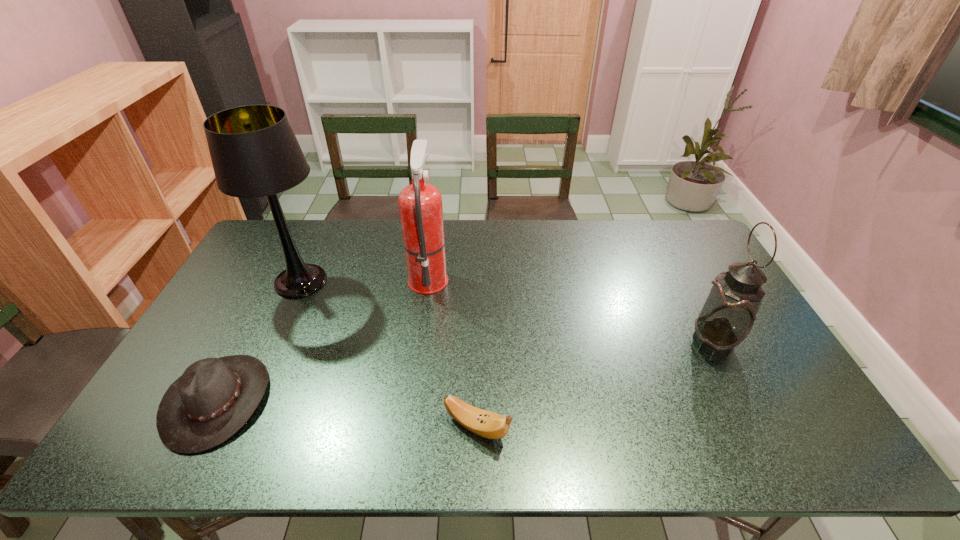
Image resolution: width=960 pixels, height=540 pixels. Identify the location of free space that satisfies the following two spatial constraints: 1. on the front side of the oil lamp; 2. on the front-facing side of the hat. (744, 400).

Image resolution: width=960 pixels, height=540 pixels. In order to click on free space that satisfies the following two spatial constraints: 1. on the front-facing side of the hat; 2. on the right side of the banana in this screenshot , I will do `click(204, 427)`.

At what (x,y) coordinates should I click in order to perform the action: click on vacant space that satisfies the following two spatial constraints: 1. with the handle and hose on the rightmost object; 2. on the left side of the fire extinguisher. Please return your answer as a coordinate pair (x, y). The height and width of the screenshot is (540, 960). Looking at the image, I should click on (420, 342).